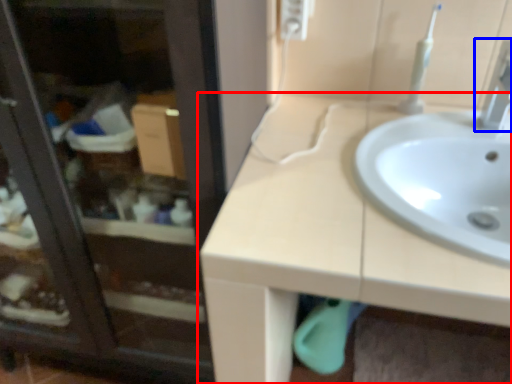
Question: Which object appears farthest to the camera in this image, countertop (highlighted by a red box) or tap (highlighted by a blue box)?

Choices:
 (A) countertop
 (B) tap

Answer: (B)